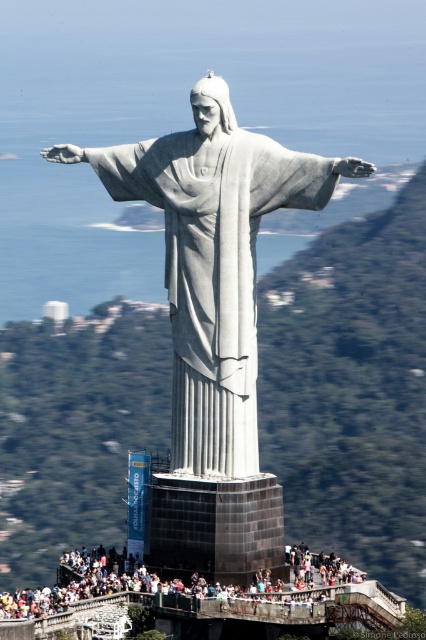
Question: Which point is farther to the camera?

Choices:
 (A) white marble statue at center
 (B) matte gray statue at center

Answer: (A)

Question: Is the position of white marble statue at center more distant than that of matte gray statue at center?

Choices:
 (A) yes
 (B) no

Answer: (A)

Question: Which of the following is the closest to the observer?

Choices:
 (A) white marble statue at center
 (B) matte gray statue at center

Answer: (B)

Question: Among these points, which one is farthest from the camera?

Choices:
 (A) (190, 433)
 (B) (166, 588)

Answer: (A)

Question: Is white marble statue at center below matte gray statue at center?

Choices:
 (A) yes
 (B) no

Answer: (B)

Question: Is white marble statue at center above matte gray statue at center?

Choices:
 (A) no
 (B) yes

Answer: (B)